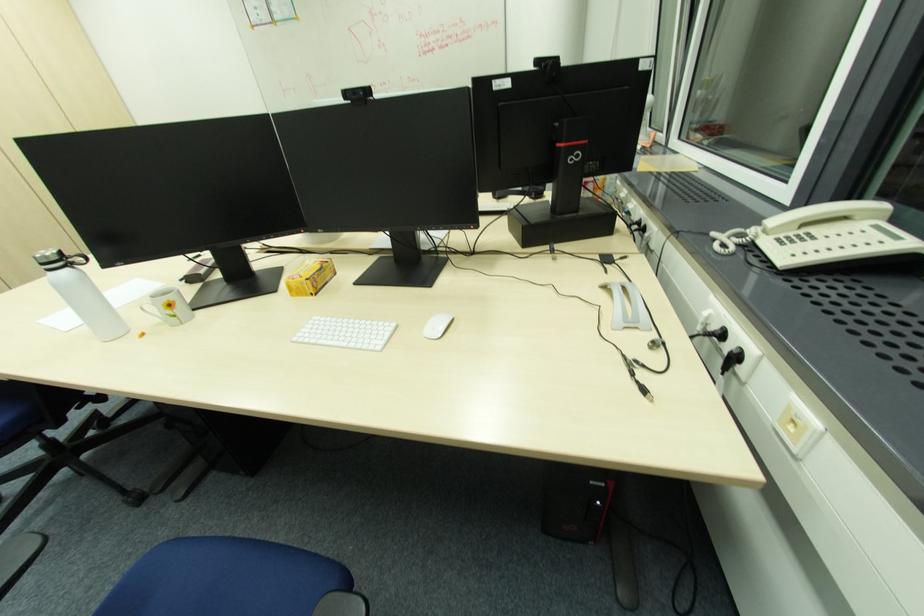
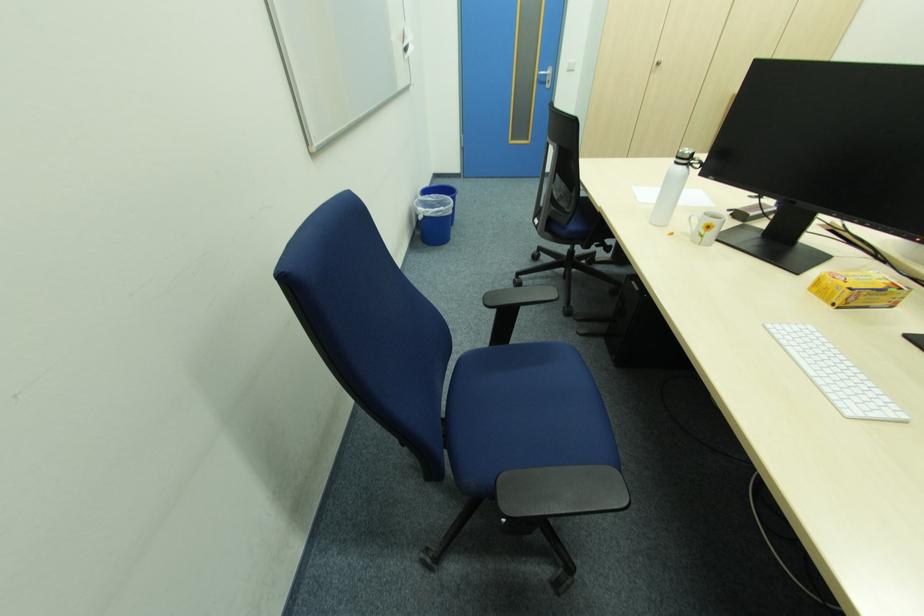
The images are taken continuously from a first-person perspective. In which direction is your viewpoint rotating?

The camera rotated toward left-down.